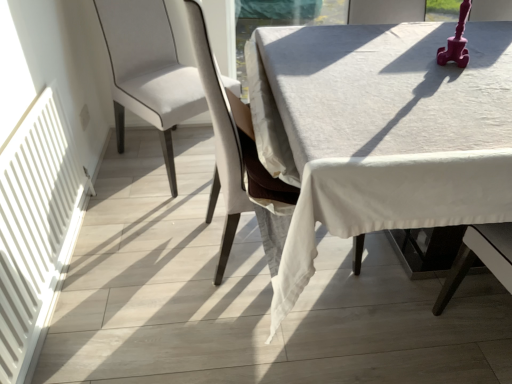
Identify the location of free spot below white fabric chair at center, the 1th chair in the right-to-left sequence (from a real-world perspective). (246, 251).